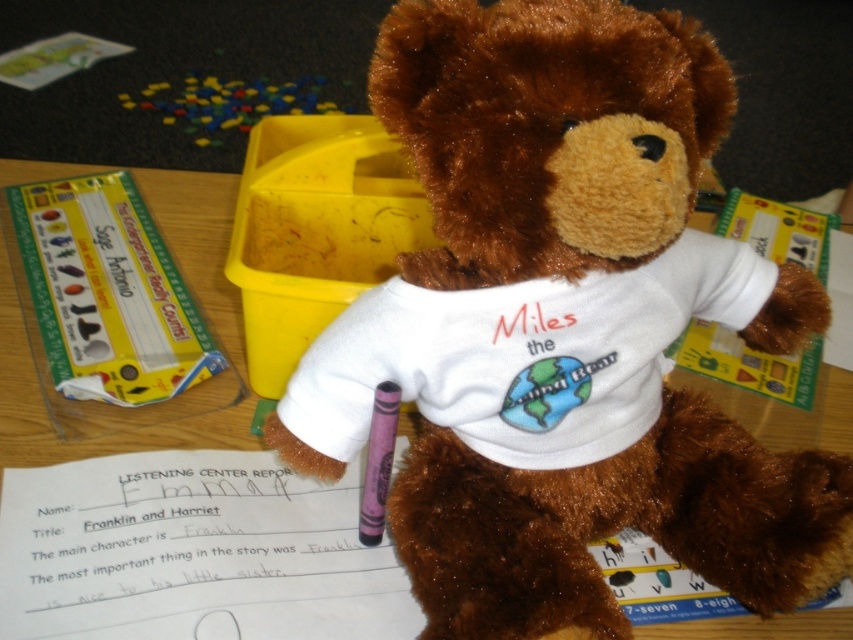
Looking at this image, you are organizing a classroom and need to place a new item on the desk where the brown plush teddy bear at center is located. The desk has limited space. Can you confirm if the point at coordinates (569,154) is a suitable location for placing a small book?

The point at coordinates (569,154) is currently occupied by the brown plush teddy bear at center, so placing a small book there would not be possible.